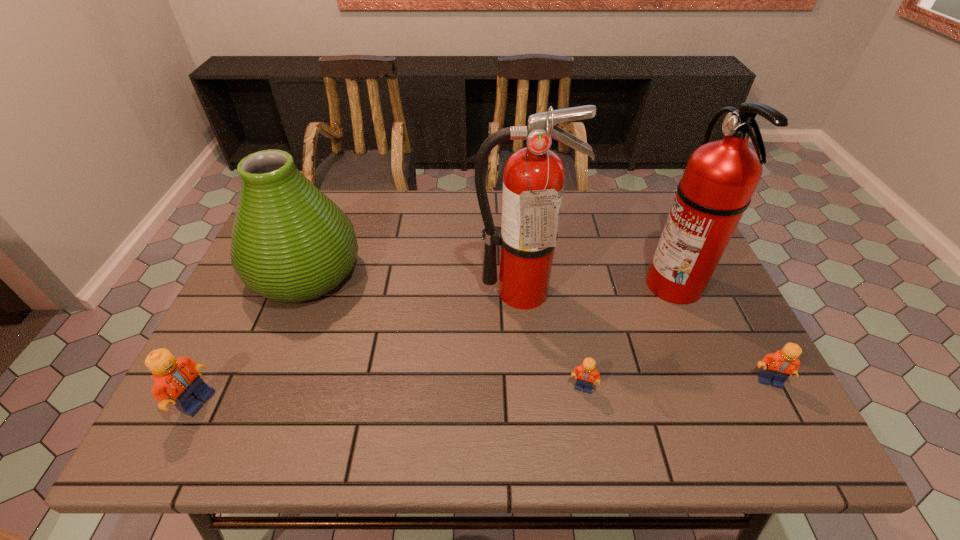
To make them evenly spaced by inserting another Lego among them, please locate a free space for this new Lego. Please provide its 2D coordinates. Your answer should be formatted as a tuple, i.e. [(x, y)], where the tuple contains the x and y coordinates of a point satisfying the conditions above.

[(393, 394)]